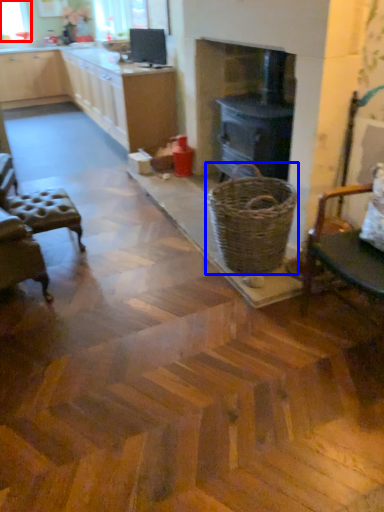
Question: Which object is closer to the camera taking this photo, window screen (highlighted by a red box) or basket (highlighted by a blue box)?

Choices:
 (A) window screen
 (B) basket

Answer: (B)